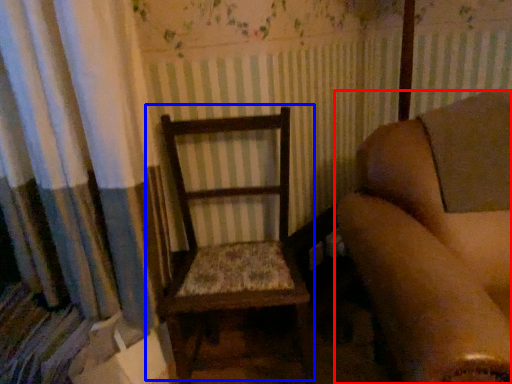
Question: Among these objects, which one is nearest to the camera, chair (highlighted by a red box) or rocking chair (highlighted by a blue box)?

Choices:
 (A) chair
 (B) rocking chair

Answer: (A)